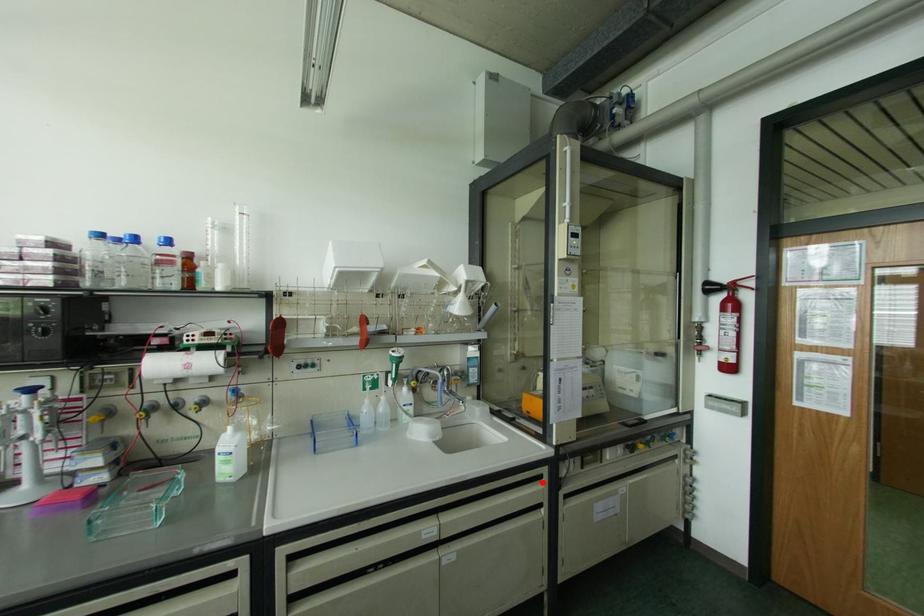
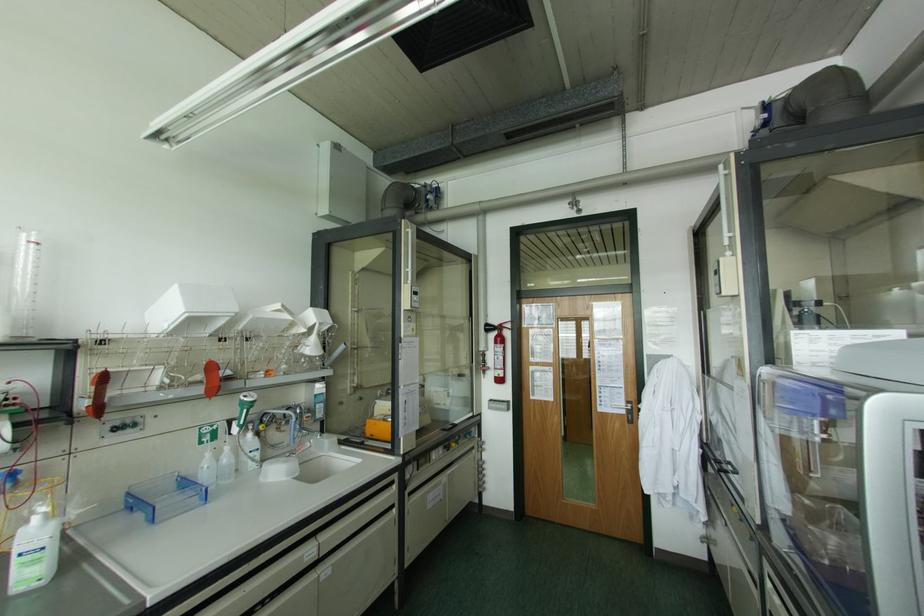
Locate, in the second image, the point that corresponds to the highlighted location in the first image.

(394, 485)